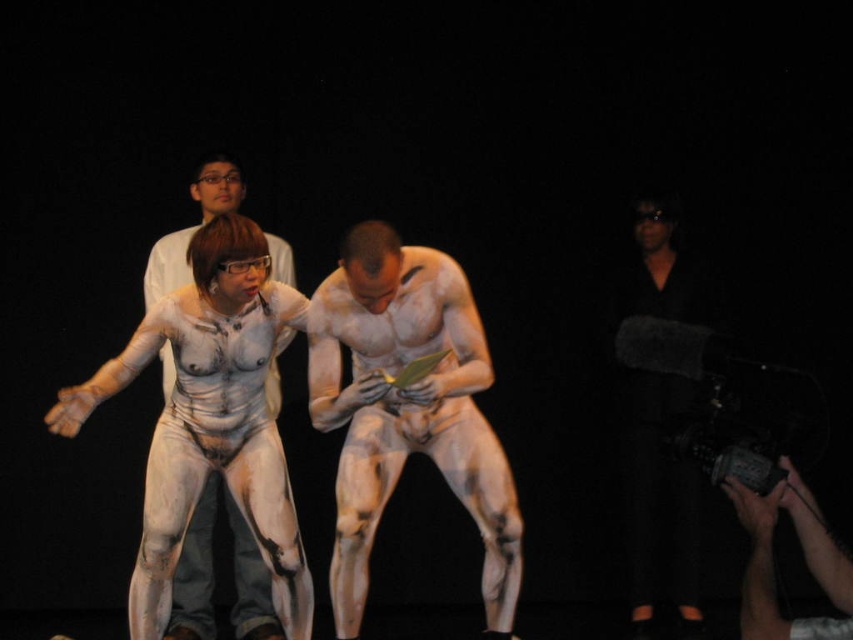
Question: Does white matte body paint at center appear on the left side of white body paint at center?

Choices:
 (A) yes
 (B) no

Answer: (B)

Question: Is white matte body paint at center to the right of white body paint at center from the viewer's perspective?

Choices:
 (A) no
 (B) yes

Answer: (B)

Question: Which point appears farthest from the camera in this image?

Choices:
 (A) (460, 282)
 (B) (189, 602)

Answer: (B)

Question: Does white matte body paint at center appear under white body paint at center?

Choices:
 (A) yes
 (B) no

Answer: (B)